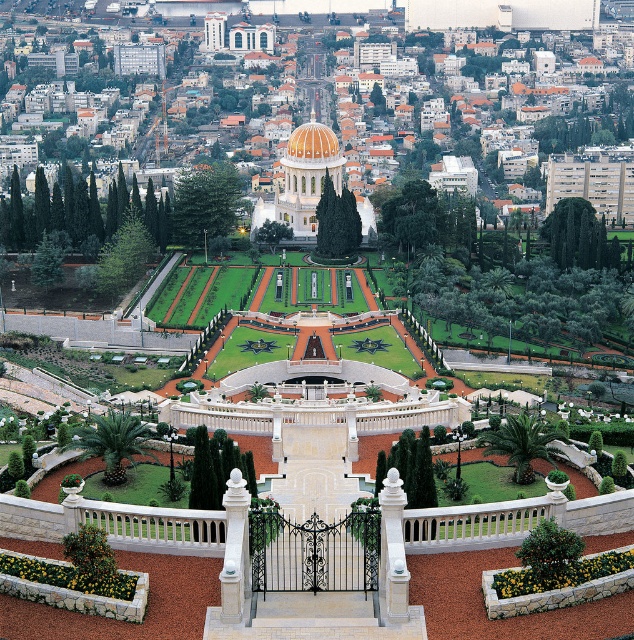
Can you confirm if white marble dome at center is bigger than golden mosaic dome at center?

Indeed, white marble dome at center has a larger size compared to golden mosaic dome at center.

Who is lower down, white marble dome at center or golden mosaic dome at center?

Positioned lower is golden mosaic dome at center.

The height and width of the screenshot is (640, 634). In order to click on white marble dome at center in this screenshot , I will do `click(353, 17)`.

The image size is (634, 640). Identify the location of white marble dome at center. (353, 17).

Is point (569, 17) farther from camera compared to point (242, 524)?

Yes, point (569, 17) is behind point (242, 524).

Is white marble dome at center further to camera compared to white marble pillar at center?

That is True.

Locate an element on the screen. Image resolution: width=634 pixels, height=640 pixels. white marble dome at center is located at coordinates (353, 17).

Does point (403, 592) come closer to viewer compared to point (325, 157)?

That is True.

Is point (391, 600) positioned behind point (327, 160)?

No, (391, 600) is closer to viewer.

Between point (401, 540) and point (302, 125), which one is positioned behind?

Point (302, 125)

Find the location of a particular element. The image size is (634, 640). white stone pillar at center is located at coordinates (392, 552).